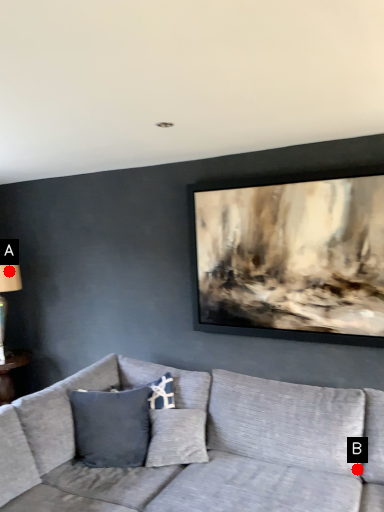
Question: Two points are circled on the image, labeled by A and B beside each circle. Which point is closer to the camera?

Choices:
 (A) A is closer
 (B) B is closer

Answer: (B)